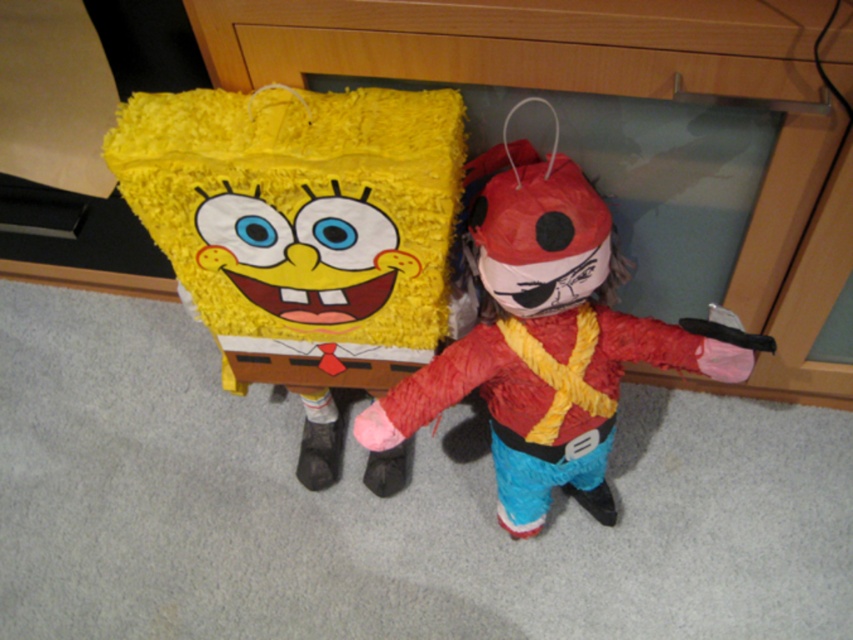
Who is positioned more to the right, matte yellow sponge at center or wooden dresser at center?

wooden dresser at center

Does matte yellow sponge at center appear on the right side of wooden dresser at center?

No, matte yellow sponge at center is not to the right of wooden dresser at center.

This screenshot has height=640, width=853. I want to click on matte yellow sponge at center, so click(x=300, y=218).

Which is more to the right, wooden dresser at center or red felt pirate at center?

wooden dresser at center is more to the right.

This screenshot has width=853, height=640. I want to click on wooden dresser at center, so click(619, 93).

Is point (701, 3) closer to camera compared to point (601, 522)?

That is True.

The height and width of the screenshot is (640, 853). Identify the location of wooden dresser at center. (619, 93).

Based on the photo, can you confirm if matte yellow sponge at center is positioned below red felt pirate at center?

No.

Can you confirm if matte yellow sponge at center is taller than red felt pirate at center?

Incorrect, matte yellow sponge at center's height is not larger of red felt pirate at center's.

Is point (291, 289) farther from viewer compared to point (492, 314)?

That is False.

At what (x,y) coordinates should I click in order to perform the action: click on matte yellow sponge at center. Please return your answer as a coordinate pair (x, y). Image resolution: width=853 pixels, height=640 pixels. Looking at the image, I should click on (300, 218).